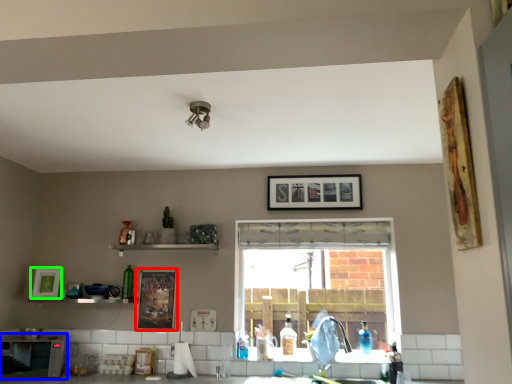
Question: Which is nearer to the picture frame (highlighted by a red box)? appliance (highlighted by a blue box) or picture frame (highlighted by a green box).

Choices:
 (A) appliance
 (B) picture frame

Answer: (A)